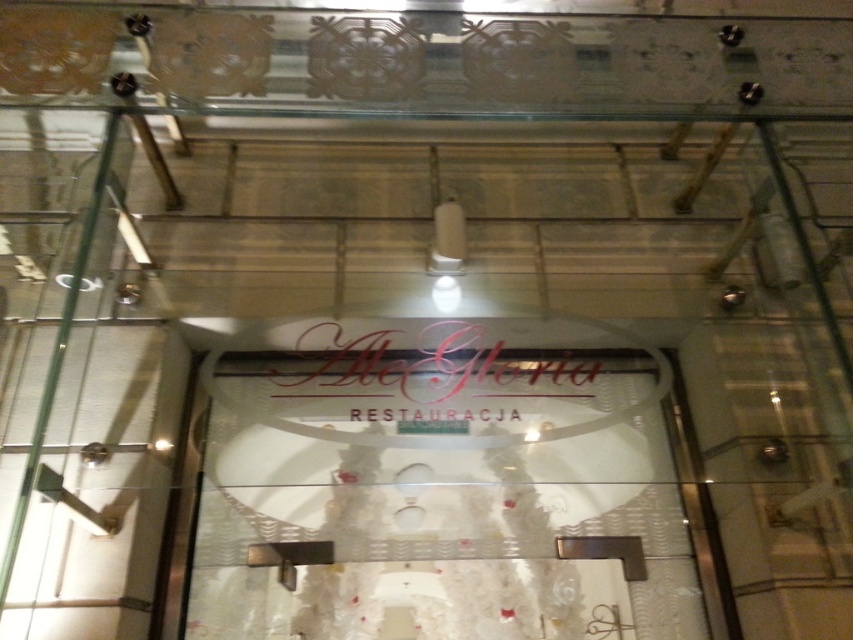
Question: Which object appears closest to the camera in this image?

Choices:
 (A) transparent glass signboard at center
 (B) matte gold sign at center

Answer: (A)

Question: Which point appears closest to the camera in this image?

Choices:
 (A) (399, 400)
 (B) (415, 557)

Answer: (B)

Question: Which point is farther from the camera taking this photo?

Choices:
 (A) (590, 508)
 (B) (451, 355)

Answer: (B)

Question: Does transparent glass signboard at center appear under matte gold sign at center?

Choices:
 (A) yes
 (B) no

Answer: (A)

Question: Is transparent glass signboard at center positioned at the back of matte gold sign at center?

Choices:
 (A) yes
 (B) no

Answer: (B)

Question: Does transparent glass signboard at center have a lesser width compared to matte gold sign at center?

Choices:
 (A) yes
 (B) no

Answer: (B)